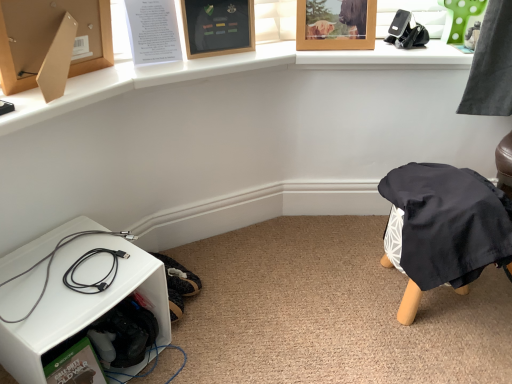
Where is `vacant space to the right of black plastic phone holder at upper right`? This screenshot has width=512, height=384. vacant space to the right of black plastic phone holder at upper right is located at coordinates (453, 46).